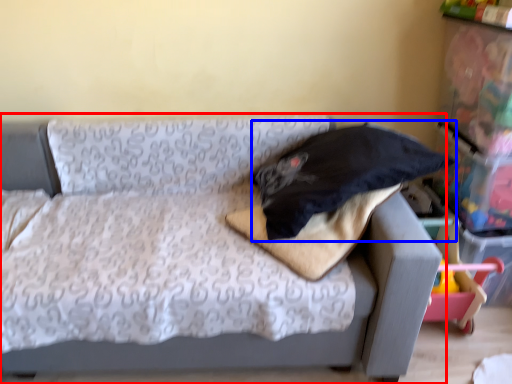
Question: Among these objects, which one is farthest to the camera, studio couch (highlighted by a red box) or pillow (highlighted by a blue box)?

Choices:
 (A) studio couch
 (B) pillow

Answer: (B)